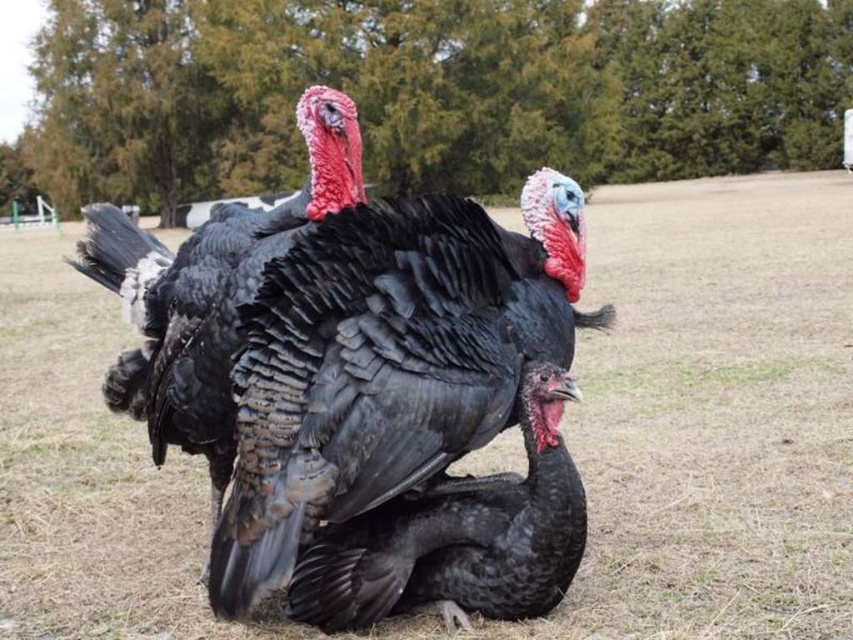
Is black matte turkey at center above shiny black turkey at center?

No, black matte turkey at center is not above shiny black turkey at center.

Can you confirm if black matte turkey at center is shorter than shiny black turkey at center?

Yes.

You are a GUI agent. You are given a task and a screenshot of the screen. Output one action in this format:
    pyautogui.click(x=<x>, y=<y>)
    Task: Click on the black matte turkey at center
    This screenshot has height=640, width=853.
    Given the screenshot: What is the action you would take?
    pyautogui.click(x=457, y=536)

Identify the location of black matte turkey at center. The height and width of the screenshot is (640, 853). (457, 536).